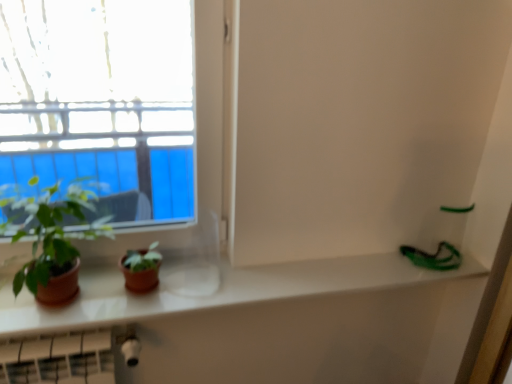
Find the location of a particular element. The width and height of the screenshot is (512, 384). free region under green matte plant at left (from a real-world perspective) is located at coordinates pyautogui.click(x=65, y=308).